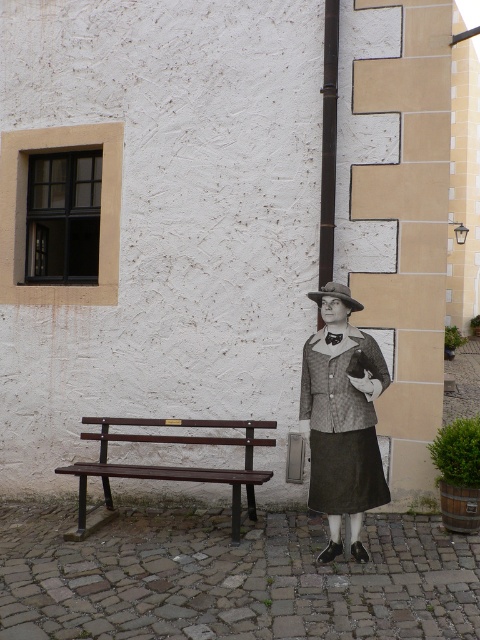
Question: In this image, where is matte gray fabric coat at center located relative to wooden bench at lower left?

Choices:
 (A) below
 (B) above

Answer: (B)

Question: Which of these objects is positioned closest to the wooden bench at lower left?

Choices:
 (A) brown felt hat at center
 (B) matte gray fabric coat at center

Answer: (B)

Question: Which is nearer to the dark brown wood pole at center?

Choices:
 (A) matte gray fabric coat at center
 (B) brown felt hat at center

Answer: (B)

Question: Does matte gray fabric coat at center have a smaller size compared to brown felt hat at center?

Choices:
 (A) yes
 (B) no

Answer: (B)

Question: Does wooden bench at lower left have a larger size compared to dark brown wood pole at center?

Choices:
 (A) no
 (B) yes

Answer: (B)

Question: Which of the following is the farthest from the observer?

Choices:
 (A) (338, 294)
 (B) (137, 465)
 (C) (369, 413)
 (D) (323, 179)

Answer: (B)